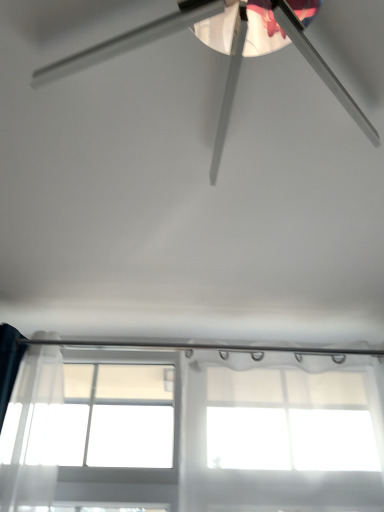
Describe the element at coordinates (108, 418) in the screenshot. I see `transparent glass window at lower center` at that location.

You are a GUI agent. You are given a task and a screenshot of the screen. Output one action in this format:
    pyautogui.click(x=<x>, y=<y>)
    Task: Click on the transparent glass window at lower center
    This screenshot has height=512, width=384.
    Given the screenshot: What is the action you would take?
    pyautogui.click(x=108, y=418)

You are a GUI agent. You are given a task and a screenshot of the screen. Output one action in this format:
    pyautogui.click(x=<x>, y=<y>)
    Task: Click on the transparent glass window at lower center
    This screenshot has width=384, height=512.
    Given the screenshot: What is the action you would take?
    pyautogui.click(x=108, y=418)